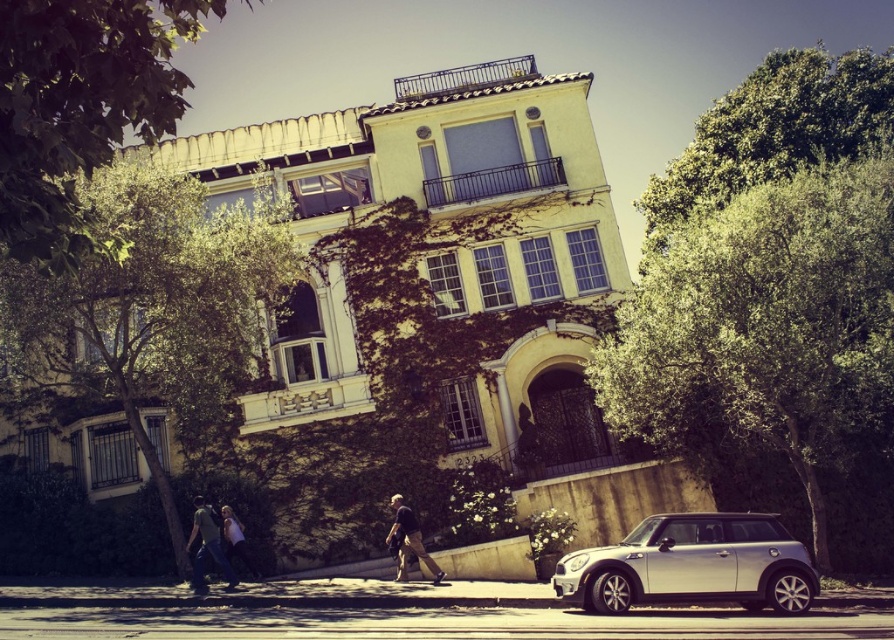
From the picture: You are a pedestrian standing at the front of the building. You see the green leafy tree at left and the silver metallic car at lower right. Which object is blocking your view of the other?

The green leafy tree at left is positioned over the silver metallic car at lower right, so the tree is blocking the view of the car.

You are standing in front of the building and notice the green leafy tree at upper left. Based on its position, can you determine if it is closer to the left edge or the right edge of the building?

The green leafy tree at upper left is located at point 0.170 on the x and y axis, so it is closer to the left edge of the building since the coordinate is closer to 0 on the x axis.

You are standing at the entrance of the building and notice a silver metallic car at lower right and a denim jacket at lower left. Which object is closer to you?

The silver metallic car at lower right is closer to you because it is in front of the denim jacket at lower left.